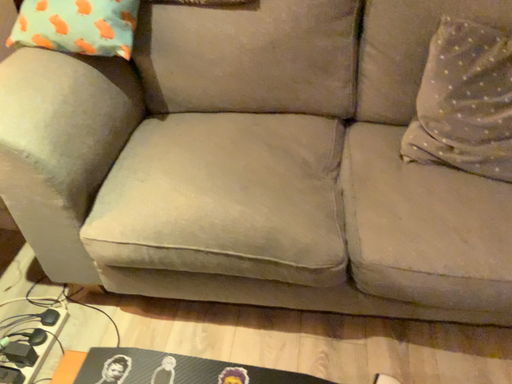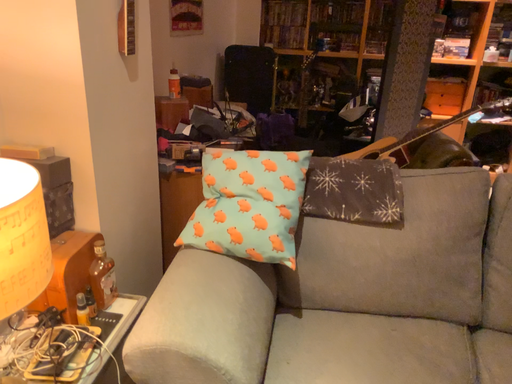
Question: How did the camera likely rotate when shooting the video?

Choices:
 (A) rotated downward
 (B) rotated upward

Answer: (B)